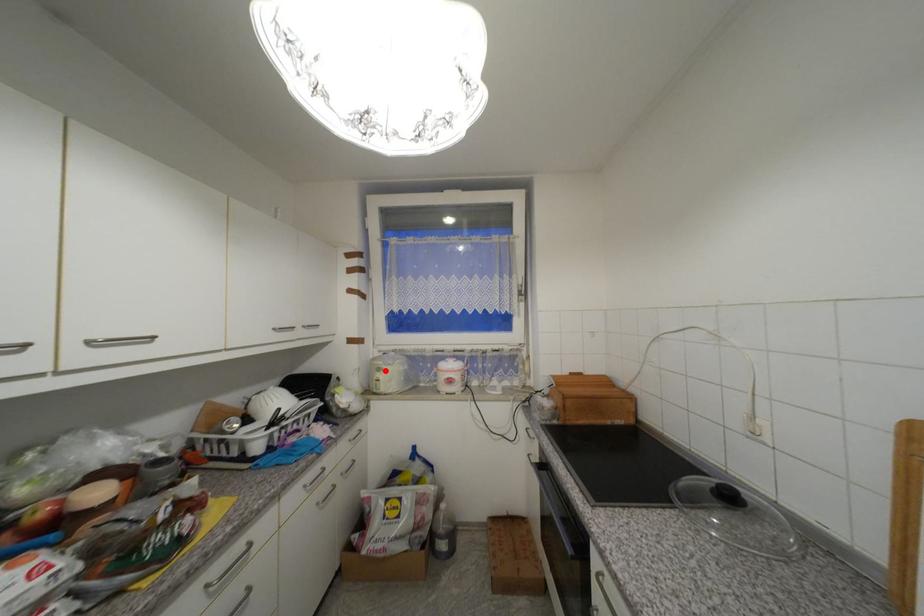
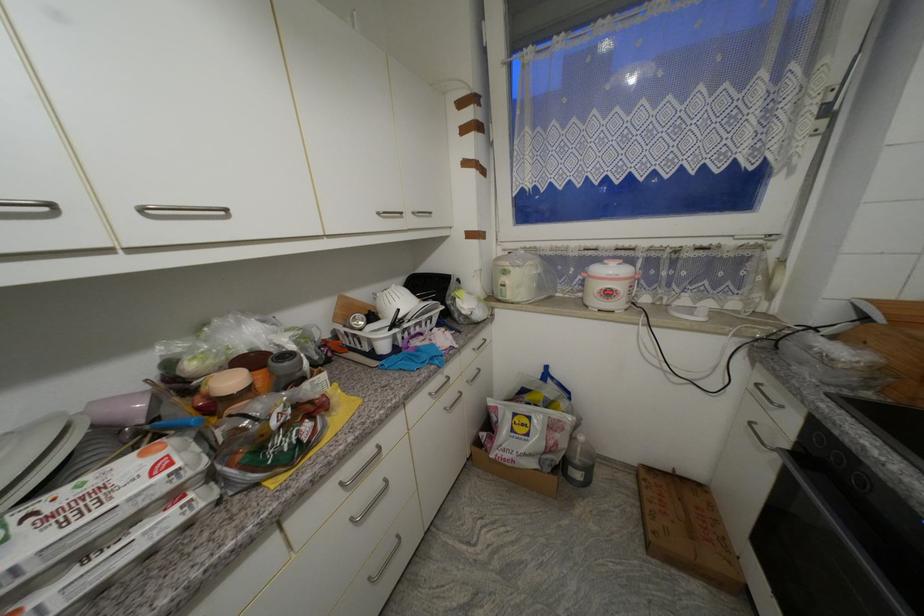
Locate, in the second image, the point that corresponds to the highlighted location in the first image.

(511, 274)